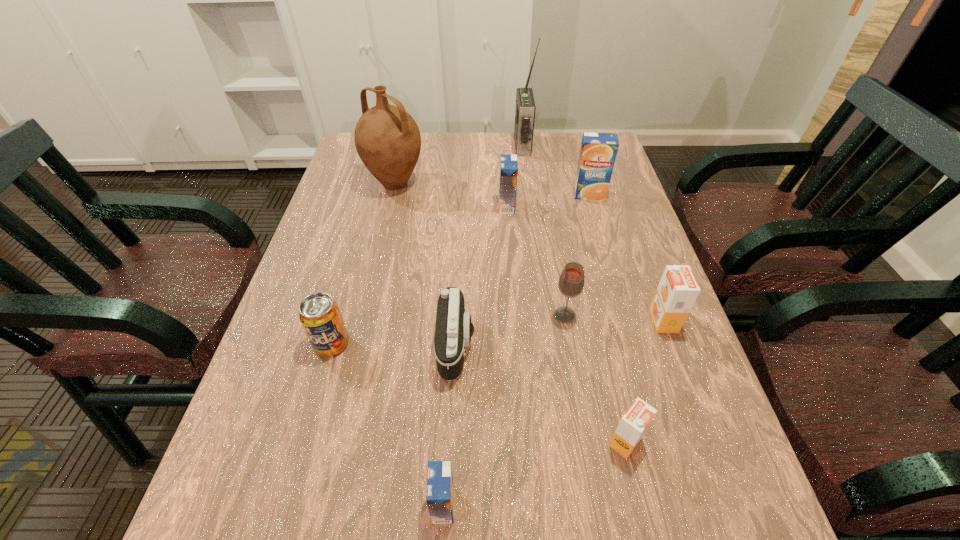
The image size is (960, 540). What are the coordinates of `soda can` in the screenshot? It's located at (319, 314).

You are a GUI agent. You are given a task and a screenshot of the screen. Output one action in this format:
    pyautogui.click(x=<x>, y=<y>)
    Task: Click on the camera
    This screenshot has height=540, width=960.
    Given the screenshot: What is the action you would take?
    pyautogui.click(x=453, y=330)

Identify the location of the left orange orange juice. (634, 423).

The height and width of the screenshot is (540, 960). In order to click on the smaller orange orange juice in this screenshot , I will do click(634, 423).

Identify the location of the smallest blue orange_juice. This screenshot has width=960, height=540. (440, 489).

The image size is (960, 540). Identify the location of the leftmost blue orange_juice. (440, 489).

Identify the location of vacant area situated 0.360m on the display of the farthest object. (407, 146).

The image size is (960, 540). Identify the location of free space located on the display of the farthest object. (476, 146).

Locate an element on the screen. vacant space located on the display of the farthest object is located at coordinates (467, 146).

Identify the location of vacant space situated 0.140m on the back of the brown pitcher. This screenshot has width=960, height=540. (404, 144).